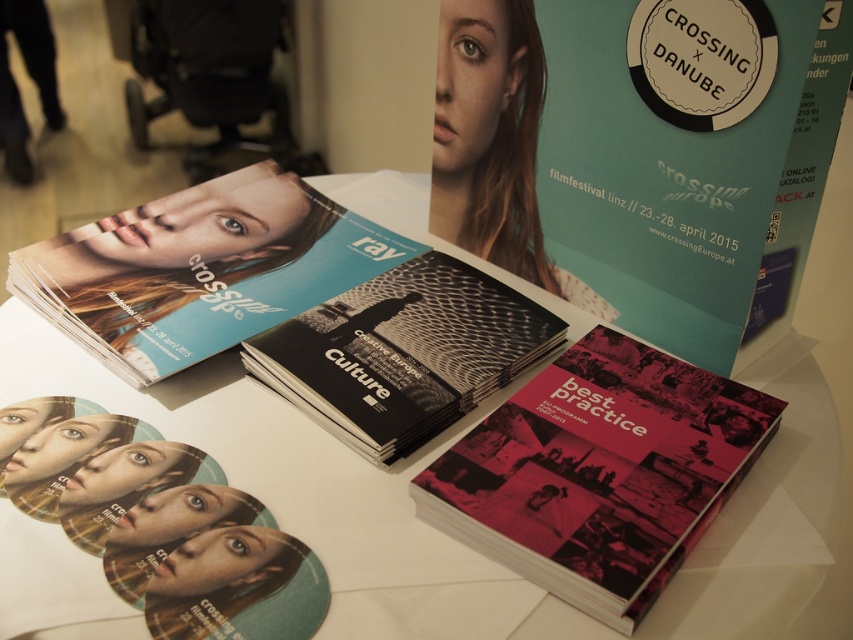
You are organizing a cultural event and have both the matte pink book at center and the black matte culture magazine at center on your table. Which item will you need to adjust the display space for due to its larger size?

The matte pink book at center is bigger than the black matte culture magazine at center, so you will need to adjust the display space for the matte pink book at center to accommodate its larger size.

You are organizing a display and need to place a new item between the matte pink book at center and the black matte culture magazine at center. Which object should you place the item closer to if you want it to be more visible to visitors?

You should place the new item closer to the matte pink book at center because it is in front of the black matte culture magazine at center, making it naturally more visible to visitors.

You are organizing a cultural event and need to display two magazines on a table. The matte blue magazine at center and the black matte culture magazine at center. Which magazine should you choose to place on a smaller stand if you want it to fit properly?

The black matte culture magazine at center is smaller in size compared to the matte blue magazine at center, so it would fit better on a smaller stand.